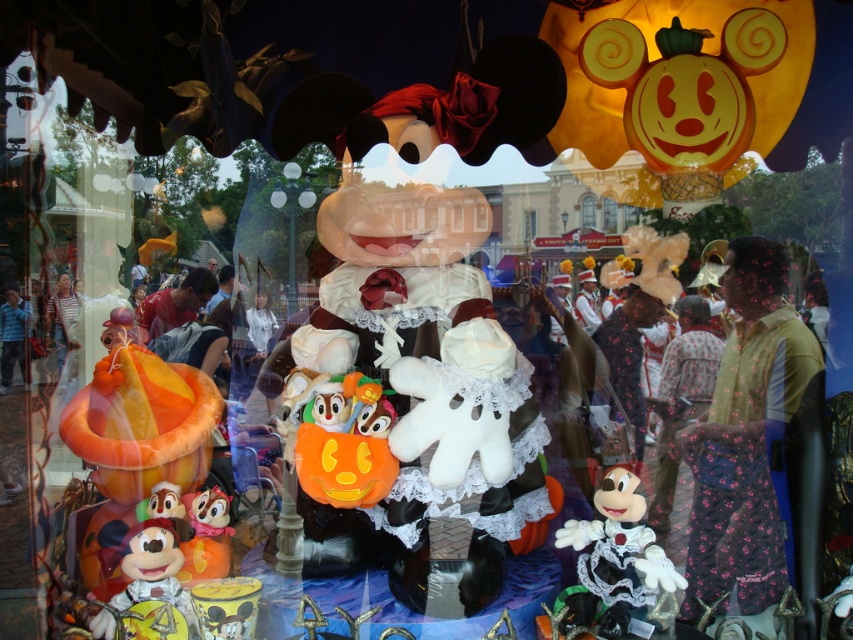
In the scene shown: You are setting up a shelf for a Disney store and have to place the white plush toy at center and the matte orange plush toy at lower left. If the shelf has a width of 1 meter, will both fit side by side without overlapping?

The white plush toy at center is wider than the matte orange plush toy at lower left. Since the shelf is 1 meter wide, we need to know the exact widths of both plush toys to determine if they can fit side by side. However, the information provided only states that the white plush toy is wider, not their specific measurements. Without exact dimensions, it is impossible to confirm if they will fit without overlapping.

Based on the photo, you are a child looking at the festive display and want to pick up the matte yellow plush toy at lower left and the matte orange plush toy at lower left. Which one is closer to the ground?

The matte yellow plush toy at lower left is below the matte orange plush toy at lower left, so it is closer to the ground.